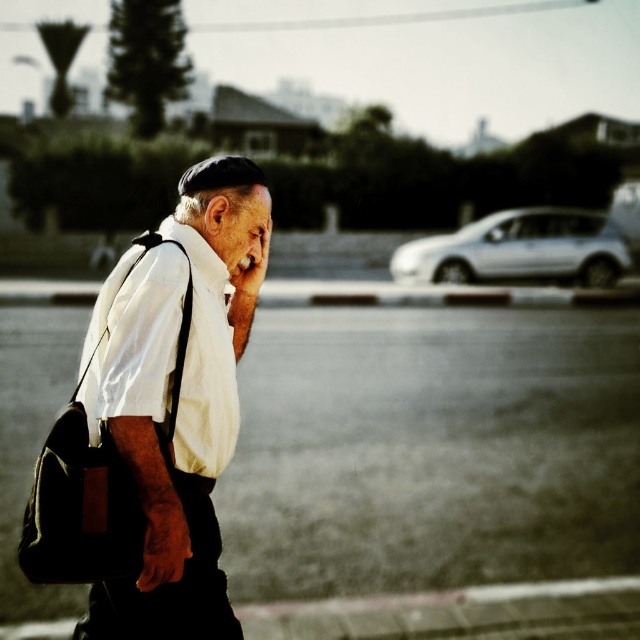
Question: In this image, where is smooth asphalt road at center located relative to white cotton shirt at left?

Choices:
 (A) above
 (B) below

Answer: (B)

Question: Does smooth asphalt road at center have a larger size compared to white matte dress shirt at center?

Choices:
 (A) yes
 (B) no

Answer: (A)

Question: Which point is closer to the camera?

Choices:
 (A) white cotton shirt at left
 (B) smooth asphalt road at center
 (C) black leather messenger bag at left
 (D) white matte dress shirt at center

Answer: (A)

Question: Which point is farther to the camera?

Choices:
 (A) white matte dress shirt at center
 (B) black leather messenger bag at left
 (C) smooth asphalt road at center

Answer: (C)

Question: Which object is the farthest from the white cotton shirt at left?

Choices:
 (A) smooth asphalt road at center
 (B) black leather messenger bag at left

Answer: (A)

Question: Is smooth asphalt road at center positioned in front of white matte dress shirt at center?

Choices:
 (A) no
 (B) yes

Answer: (A)